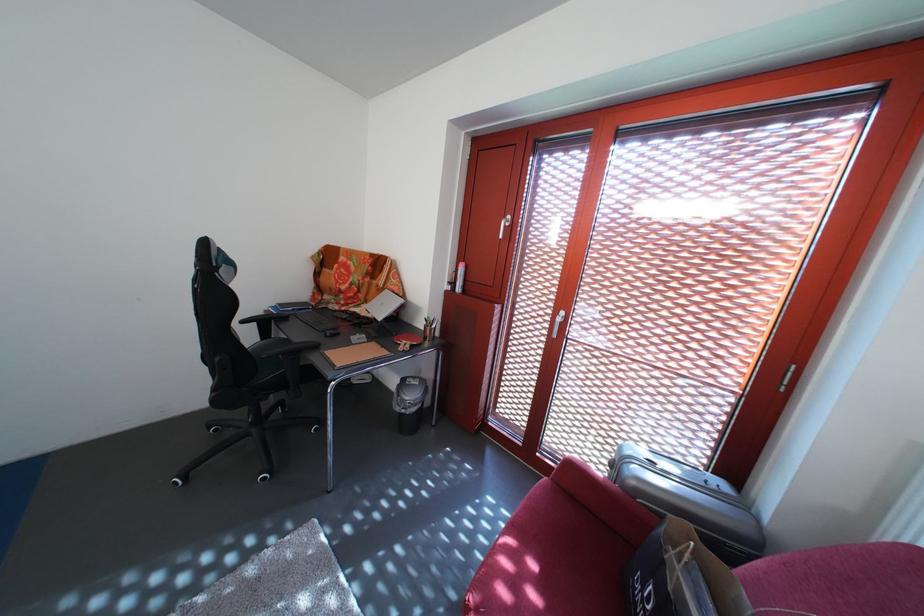
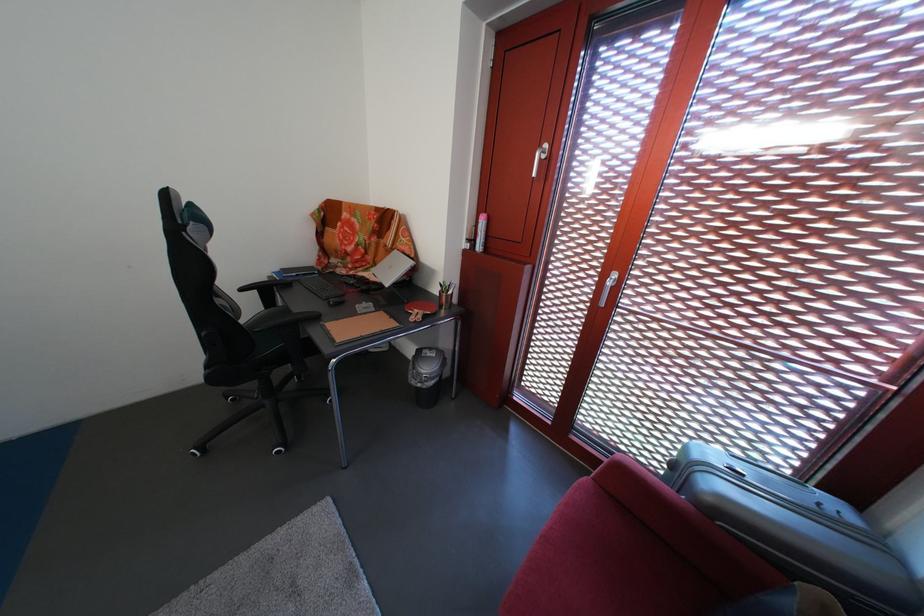
Question: I am providing you with two images of the same scene from different viewpoints. Please identify which objects are invisible in image2.

Choices:
 (A) silver window handle
 (B) red sofa armrest
 (C) pink spray can
 (D) none of these

Answer: (D)